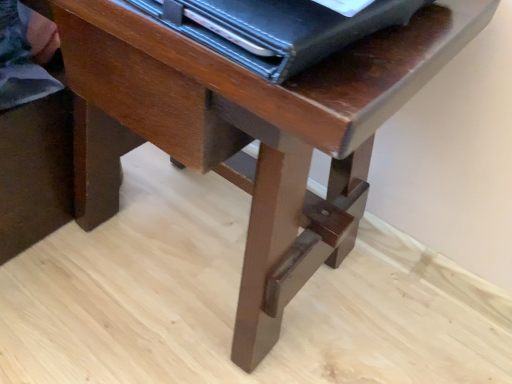
You are a GUI agent. You are given a task and a screenshot of the screen. Output one action in this format:
    pyautogui.click(x=<x>, y=<y>)
    Task: Click on the black leather book at upper center
    The width and height of the screenshot is (512, 384).
    Given the screenshot: What is the action you would take?
    (x=275, y=29)

This screenshot has width=512, height=384. What do you see at coordinates (275, 29) in the screenshot?
I see `black leather book at upper center` at bounding box center [275, 29].

This screenshot has width=512, height=384. I want to click on black leather book at upper center, so pyautogui.click(x=275, y=29).